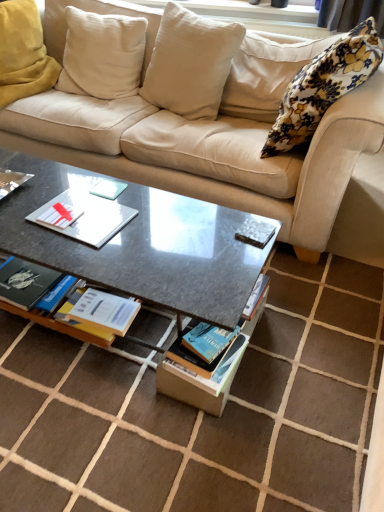
Where is `vacant area situated to the left side of white matte paper at center`? This screenshot has height=512, width=384. vacant area situated to the left side of white matte paper at center is located at coordinates (21, 221).